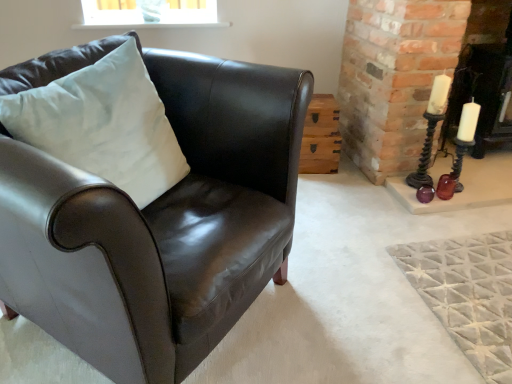
Question: Considering the relative positions of white satin pillow at left and wooden crate at center-right in the image provided, is white satin pillow at left in front of wooden crate at center-right?

Choices:
 (A) yes
 (B) no

Answer: (A)

Question: Is the depth of white satin pillow at left greater than that of wooden crate at center-right?

Choices:
 (A) yes
 (B) no

Answer: (B)

Question: Does white satin pillow at left touch wooden crate at center-right?

Choices:
 (A) yes
 (B) no

Answer: (B)

Question: Does white satin pillow at left have a greater height compared to wooden crate at center-right?

Choices:
 (A) no
 (B) yes

Answer: (B)

Question: Considering the relative sizes of white satin pillow at left and wooden crate at center-right in the image provided, is white satin pillow at left smaller than wooden crate at center-right?

Choices:
 (A) no
 (B) yes

Answer: (A)

Question: From their relative heights in the image, would you say metallic dark brown candle holder at right is taller or shorter than white glossy fireplace at right?

Choices:
 (A) tall
 (B) short

Answer: (B)

Question: From the image's perspective, relative to white glossy fireplace at right, is metallic dark brown candle holder at right above or below?

Choices:
 (A) below
 (B) above

Answer: (A)

Question: Based on their positions, is metallic dark brown candle holder at right located to the left or right of white glossy fireplace at right?

Choices:
 (A) right
 (B) left

Answer: (B)

Question: Does point (423, 152) appear closer or farther from the camera than point (496, 11)?

Choices:
 (A) farther
 (B) closer

Answer: (B)

Question: From a real-world perspective, is white glossy fireplace at right above or below shiny brown leather armchair at left?

Choices:
 (A) below
 (B) above

Answer: (B)

Question: Looking at the image, does white glossy fireplace at right seem bigger or smaller compared to shiny brown leather armchair at left?

Choices:
 (A) big
 (B) small

Answer: (B)

Question: Is white glossy fireplace at right in front of or behind shiny brown leather armchair at left in the image?

Choices:
 (A) behind
 (B) front

Answer: (A)

Question: Is white glossy fireplace at right inside or outside of shiny brown leather armchair at left?

Choices:
 (A) outside
 (B) inside

Answer: (A)

Question: Relative to metallic dark brown candle holder at right, is wooden crate at center-right in front or behind?

Choices:
 (A) front
 (B) behind

Answer: (B)

Question: Is wooden crate at center-right spatially inside metallic dark brown candle holder at right, or outside of it?

Choices:
 (A) inside
 (B) outside

Answer: (B)